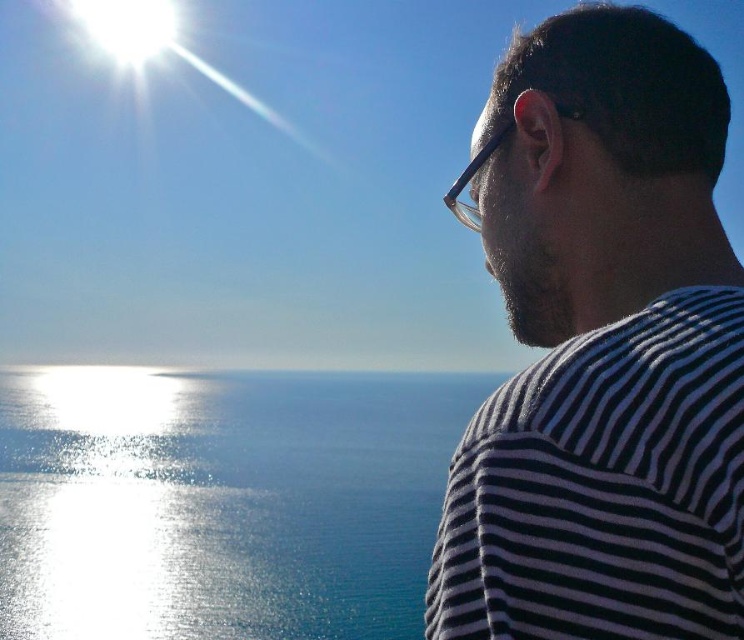
Which is behind, point (734, 282) or point (166, 529)?

The point (166, 529) is behind.

Is point (620, 257) closer to viewer compared to point (25, 499)?

Yes, it is.

At what (x,y) coordinates should I click in order to perform the action: click on black striped shirt at right. Please return your answer as a coordinate pair (x, y). Looking at the image, I should click on (600, 348).